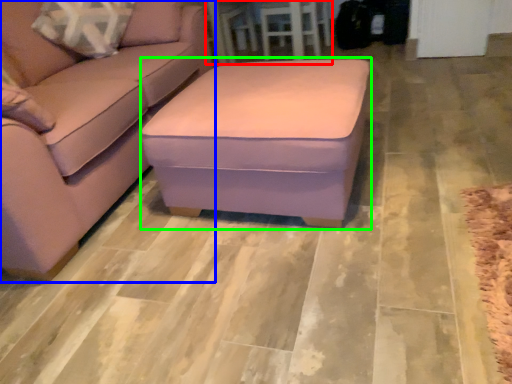
Question: Which object is the farthest from table (highlighted by a red box)? Choose among these: studio couch (highlighted by a blue box) or stool (highlighted by a green box).

Choices:
 (A) studio couch
 (B) stool

Answer: (B)